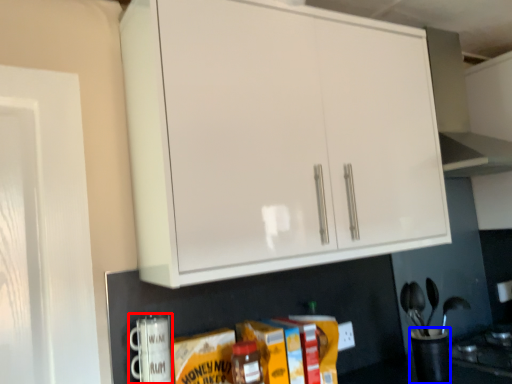
Question: Which of the following is the closest to the observer, appliance (highlighted by a red box) or appliance (highlighted by a blue box)?

Choices:
 (A) appliance
 (B) appliance

Answer: (A)